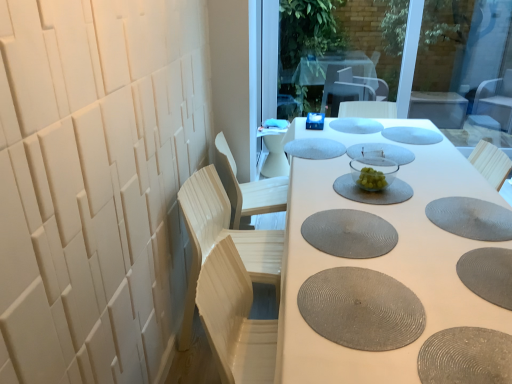
What is the approximate width of clear glass bowl at center, placed as the seventh manhole cover when sorted from front to back?

It is 13.71 inches.

Locate an element on the screen. This screenshot has width=512, height=384. white wood chair at center, the 1th chair viewed from the back is located at coordinates (274, 148).

Where is `light wood chair at center, which is counted as the second chair, starting from the back`? This screenshot has width=512, height=384. light wood chair at center, which is counted as the second chair, starting from the back is located at coordinates (252, 188).

What is the approximate height of textured gray manhole cover at lower right, which is the 10th manhole cover from back to front?

The height of textured gray manhole cover at lower right, which is the 10th manhole cover from back to front, is 0.39 inches.

This screenshot has width=512, height=384. Identify the location of textured gray manhole cover at lower right, which is the 10th manhole cover from back to front. (466, 357).

How much space does gray textured placemat at lower right, which is the fifth manhole cover from front to back, occupy horizontally?

13.40 inches.

I want to click on clear glass bowl at center, which is the fourth manhole cover in back-to-front order, so click(381, 152).

Considering the relative sizes of light blue fabric cushion at center, placed as the 8th manhole cover when sorted from front to back, and gray textured placemat at lower right, the 6th manhole cover in the back-to-front sequence, in the image provided, is light blue fabric cushion at center, placed as the 8th manhole cover when sorted from front to back, taller than gray textured placemat at lower right, the 6th manhole cover in the back-to-front sequence,?

Incorrect, the height of light blue fabric cushion at center, placed as the 8th manhole cover when sorted from front to back, is not larger of that of gray textured placemat at lower right, the 6th manhole cover in the back-to-front sequence.

Relative to gray textured placemat at lower right, the 6th manhole cover in the back-to-front sequence, is light blue fabric cushion at center, placed as the 8th manhole cover when sorted from front to back, in front or behind?

In the image, light blue fabric cushion at center, placed as the 8th manhole cover when sorted from front to back, appears behind gray textured placemat at lower right, the 6th manhole cover in the back-to-front sequence.

Considering the positions of points (339, 147) and (434, 211), is point (339, 147) closer to camera compared to point (434, 211)?

That is False.

Considering the sizes of objects light blue fabric cushion at center, placed as the 8th manhole cover when sorted from front to back, and gray textured placemat at lower right, the 6th manhole cover in the back-to-front sequence, in the image provided, who is bigger, light blue fabric cushion at center, placed as the 8th manhole cover when sorted from front to back, or gray textured placemat at lower right, the 6th manhole cover in the back-to-front sequence,?

light blue fabric cushion at center, placed as the 8th manhole cover when sorted from front to back, is bigger.

From a real-world perspective, does gray rubber mat at center, which appears as the 2th manhole cover when viewed from the back, stand above transparent glass window screen at upper center?

No.

Based on the photo, from the image's perspective, which is above, gray rubber mat at center, which appears as the 2th manhole cover when viewed from the back, or transparent glass window screen at upper center?

transparent glass window screen at upper center.

Does gray rubber mat at center, which appears as the 2th manhole cover when viewed from the back, have a greater width compared to transparent glass window screen at upper center?

Indeed, gray rubber mat at center, which appears as the 2th manhole cover when viewed from the back, has a greater width compared to transparent glass window screen at upper center.

From a real-world perspective, between gray textured placemat at lower right, which is the fifth manhole cover from front to back, and clear glass bowl at center, which is the fourth manhole cover in back-to-front order, who is vertically lower?

gray textured placemat at lower right, which is the fifth manhole cover from front to back, from a real-world perspective.

Looking at the image, does gray textured placemat at lower right, the 6th manhole cover in the back-to-front sequence, seem bigger or smaller compared to clear glass bowl at center, placed as the seventh manhole cover when sorted from front to back?

Considering their sizes, gray textured placemat at lower right, the 6th manhole cover in the back-to-front sequence, takes up less space than clear glass bowl at center, placed as the seventh manhole cover when sorted from front to back.

Could you tell me if gray textured placemat at lower right, which is the fifth manhole cover from front to back, is facing clear glass bowl at center, which is the fourth manhole cover in back-to-front order?

No, gray textured placemat at lower right, which is the fifth manhole cover from front to back, is not turned towards clear glass bowl at center, which is the fourth manhole cover in back-to-front order.

Is gray textured placemat at lower right, the eighth manhole cover in the back-to-front sequence, smaller than gray rubber mat at center, which appears as the 2th manhole cover when viewed from the back?

No.

Considering the positions of objects gray textured placemat at lower right, the eighth manhole cover in the back-to-front sequence, and gray rubber mat at center, which appears as the 2th manhole cover when viewed from the back, in the image provided, who is more to the left, gray textured placemat at lower right, the eighth manhole cover in the back-to-front sequence, or gray rubber mat at center, which appears as the 2th manhole cover when viewed from the back,?

gray textured placemat at lower right, the eighth manhole cover in the back-to-front sequence.

Based on the photo, from a real-world perspective, between gray textured placemat at lower right, the eighth manhole cover in the back-to-front sequence, and gray rubber mat at center, which appears as the 2th manhole cover when viewed from the back, who is vertically higher?

From a 3D spatial view, gray textured placemat at lower right, the eighth manhole cover in the back-to-front sequence, is above.

Which object is positioned more to the left, light wood chair at center, marked as the third chair in a back-to-front arrangement, or white wood chair at center, the 1th chair viewed from the back?

light wood chair at center, marked as the third chair in a back-to-front arrangement.

How many degrees apart are the facing directions of light wood chair at center, which appears as the 1th chair when viewed from the front, and white wood chair at center, which is the third chair in front-to-back order?

The facing directions of light wood chair at center, which appears as the 1th chair when viewed from the front, and white wood chair at center, which is the third chair in front-to-back order, are 1.1 degrees apart.

At what (x,y) coordinates should I click in order to perform the action: click on the 2nd chair above the light wood chair at center, which appears as the 1th chair when viewed from the front (from the image's perspective). Please return your answer as a coordinate pair (x, y). The height and width of the screenshot is (384, 512). Looking at the image, I should click on (274, 148).

Which object is further away from the camera, light wood chair at center, which appears as the 1th chair when viewed from the front, or white wood chair at center, which is the third chair in front-to-back order?

Positioned behind is white wood chair at center, which is the third chair in front-to-back order.

Can you confirm if clear glass bowl at center is positioned to the left of gray rubber mat at center, which appears as the 9th manhole cover when viewed from the front?

Correct, you'll find clear glass bowl at center to the left of gray rubber mat at center, which appears as the 9th manhole cover when viewed from the front.

Is clear glass bowl at center aimed at gray rubber mat at center, which appears as the 2th manhole cover when viewed from the back?

No, clear glass bowl at center is not aimed at gray rubber mat at center, which appears as the 2th manhole cover when viewed from the back.

Does clear glass bowl at center have a greater width compared to gray rubber mat at center, which appears as the 9th manhole cover when viewed from the front?

Incorrect, the width of clear glass bowl at center does not surpass that of gray rubber mat at center, which appears as the 9th manhole cover when viewed from the front.

Can you confirm if clear glass bowl at center is shorter than gray rubber mat at center, which appears as the 9th manhole cover when viewed from the front?

Incorrect, the height of clear glass bowl at center does not fall short of that of gray rubber mat at center, which appears as the 9th manhole cover when viewed from the front.

Which of these two, matte gray placemat at center or light wood chair at center, marked as the third chair in a back-to-front arrangement, is smaller?

light wood chair at center, marked as the third chair in a back-to-front arrangement.

Who is taller, matte gray placemat at center or light wood chair at center, marked as the third chair in a back-to-front arrangement?

With more height is light wood chair at center, marked as the third chair in a back-to-front arrangement.

From the image's perspective, is matte gray placemat at center below light wood chair at center, marked as the third chair in a back-to-front arrangement?

No, from the image's perspective, matte gray placemat at center is not beneath light wood chair at center, marked as the third chair in a back-to-front arrangement.

Image resolution: width=512 pixels, height=384 pixels. Identify the location of manhole cover that is the 3rd one when counting downward from the light blue fabric cushion at center, placed as the 8th manhole cover when sorted from front to back (from the image's perspective). (471, 218).

This screenshot has width=512, height=384. Find the location of `window screen above the gray rubber mat at center, which appears as the 9th manhole cover when viewed from the front (from a real-world perspective)`. window screen above the gray rubber mat at center, which appears as the 9th manhole cover when viewed from the front (from a real-world perspective) is located at coordinates (438, 52).

Which object lies further to the anchor point gray textured placemat at lower right, the eighth manhole cover in the back-to-front sequence, gray textured placemat at lower right, the 6th manhole cover in the back-to-front sequence, or gray rubber mat at center, which appears as the 2th manhole cover when viewed from the back?

gray rubber mat at center, which appears as the 2th manhole cover when viewed from the back.

When comparing their distances from matte gray placemat at center, does light wood chair at center, placed as the 2th chair when sorted from front to back, or white wood chair at center, which is the third chair in front-to-back order, seem further?

Based on the image, white wood chair at center, which is the third chair in front-to-back order, appears to be further to matte gray placemat at center.

Considering their positions, is light blue fabric cushion at center, placed as the 8th manhole cover when sorted from front to back, positioned closer to gray rubber mat at center, which appears as the 2th manhole cover when viewed from the back, than light wood swivel chair at left?

light blue fabric cushion at center, placed as the 8th manhole cover when sorted from front to back, is closer to gray rubber mat at center, which appears as the 2th manhole cover when viewed from the back.

Considering their positions, is light wood chair at center, placed as the 2th chair when sorted from front to back, positioned closer to light blue fabric cushion at center, the third manhole cover when ordered from back to front, than clear glass bowl at center, placed as the seventh manhole cover when sorted from front to back?

clear glass bowl at center, placed as the seventh manhole cover when sorted from front to back.

Based on their spatial positions, is matte gray placemat at center or white wood chair at center, which is the third chair in front-to-back order, further from light wood chair at center, which appears as the 1th chair when viewed from the front?

white wood chair at center, which is the third chair in front-to-back order, lies further to light wood chair at center, which appears as the 1th chair when viewed from the front, than the other object.

Based on their spatial positions, is gray textured placemat at center, which is the 2th manhole cover in front-to-back order, or clear glass bowl at center closer to light wood chair at center, placed as the 2th chair when sorted from front to back?

Among the two, clear glass bowl at center is located nearer to light wood chair at center, placed as the 2th chair when sorted from front to back.

Consider the image. Estimate the real-world distances between objects in this image. Which object is further from light wood swivel chair at left, matte gray placemat at center or gray textured placemat at lower right, which is the fifth manhole cover from front to back?

gray textured placemat at lower right, which is the fifth manhole cover from front to back, is further to light wood swivel chair at left.

Based on their spatial positions, is clear glass bowl at center, the sixth manhole cover positioned from the front, or clear glass bowl at center, which is the fourth manhole cover in back-to-front order, closer to gray textured placemat at lower right, placed as the third manhole cover when sorted from front to back?

clear glass bowl at center, the sixth manhole cover positioned from the front, is positioned closer to the anchor gray textured placemat at lower right, placed as the third manhole cover when sorted from front to back.

The image size is (512, 384). I want to click on window screen between gray textured placemat at center, which is counted as the fourth manhole cover, starting from the front, and white wood chair at center, which is the third chair in front-to-back order, along the z-axis, so click(x=438, y=52).

Where is `chair between light wood swivel chair at left and clear glass bowl at center, which is counted as the 5th manhole cover, starting from the back, along the z-axis`? The image size is (512, 384). chair between light wood swivel chair at left and clear glass bowl at center, which is counted as the 5th manhole cover, starting from the back, along the z-axis is located at coordinates (226, 231).

Where is `tableware located between gray textured placemat at lower right, which is the fifth manhole cover from front to back, and blue fabric cushion at center, the first manhole cover in the back-to-front sequence, in the depth direction`? The image size is (512, 384). tableware located between gray textured placemat at lower right, which is the fifth manhole cover from front to back, and blue fabric cushion at center, the first manhole cover in the back-to-front sequence, in the depth direction is located at coordinates (373, 172).

Locate an element on the screen. The width and height of the screenshot is (512, 384). tableware between gray textured placemat at lower right, placed as the third manhole cover when sorted from front to back, and light blue fabric cushion at center, the third manhole cover when ordered from back to front, in the front-back direction is located at coordinates (373, 172).